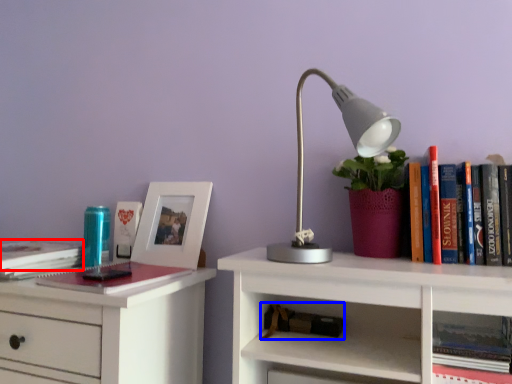
Question: Which object is further to the camera taking this photo, book (highlighted by a red box) or book (highlighted by a blue box)?

Choices:
 (A) book
 (B) book

Answer: (B)